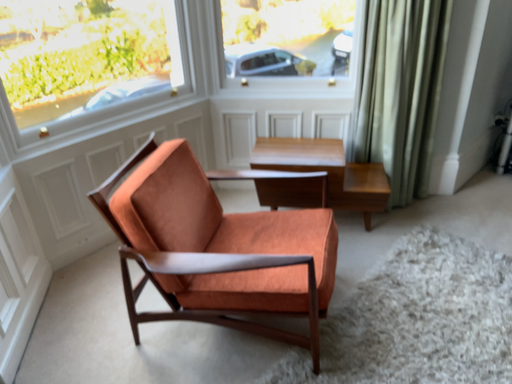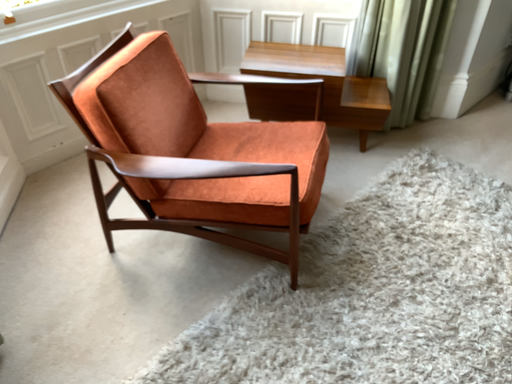
Question: Which way did the camera rotate in the video?

Choices:
 (A) rotated downward
 (B) rotated upward

Answer: (A)